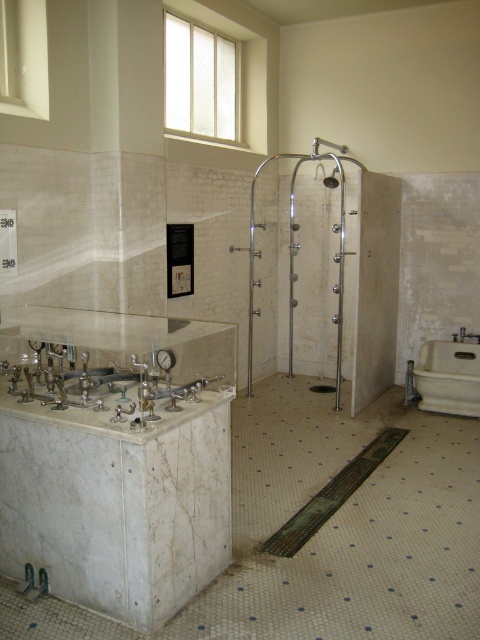
Is point (226, 394) closer to viewer compared to point (313, 138)?

That is True.

This screenshot has height=640, width=480. What do you see at coordinates (103, 396) in the screenshot? I see `white marble sink at lower left` at bounding box center [103, 396].

Locate an element on the screen. The width and height of the screenshot is (480, 640). white marble sink at lower left is located at coordinates (103, 396).

Locate an element on the screen. The width and height of the screenshot is (480, 640). white marble sink at lower left is located at coordinates (103, 396).

Is white marble sink at lower left thinner than white porcelain bathtub at lower right?

No.

Is point (155, 420) farther from camera compared to point (436, 392)?

No, (155, 420) is closer to viewer.

This screenshot has height=640, width=480. I want to click on white marble sink at lower left, so click(103, 396).

In the scene shown: Is white porcelain bathtub at lower right positioned in front of satin nickel shower head at upper center?

Yes, white porcelain bathtub at lower right is in front of satin nickel shower head at upper center.

Does point (451, 394) lie in front of point (314, 150)?

Yes, point (451, 394) is closer to viewer.

Does point (474, 355) come closer to viewer compared to point (343, 145)?

Yes.

Locate an element on the screen. white porcelain bathtub at lower right is located at coordinates (448, 378).